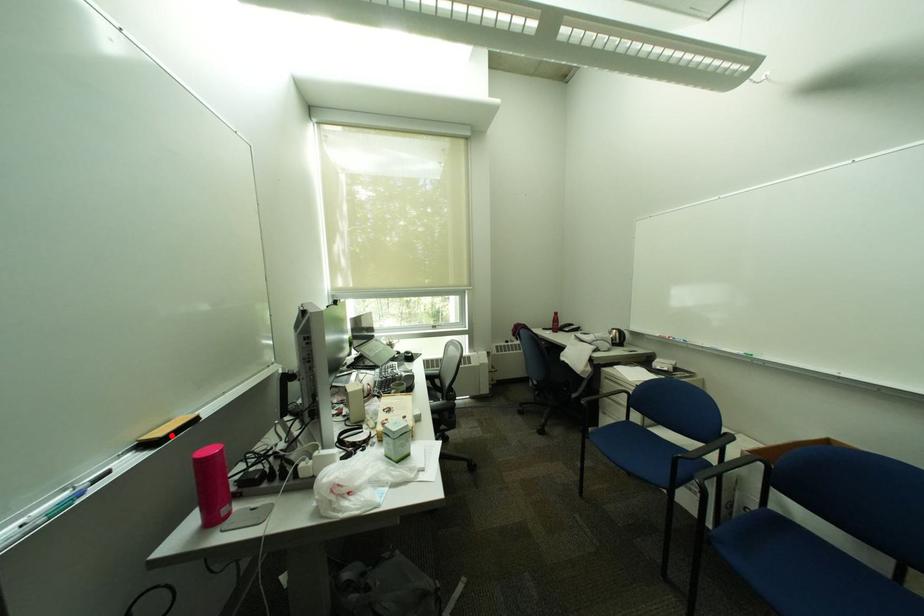
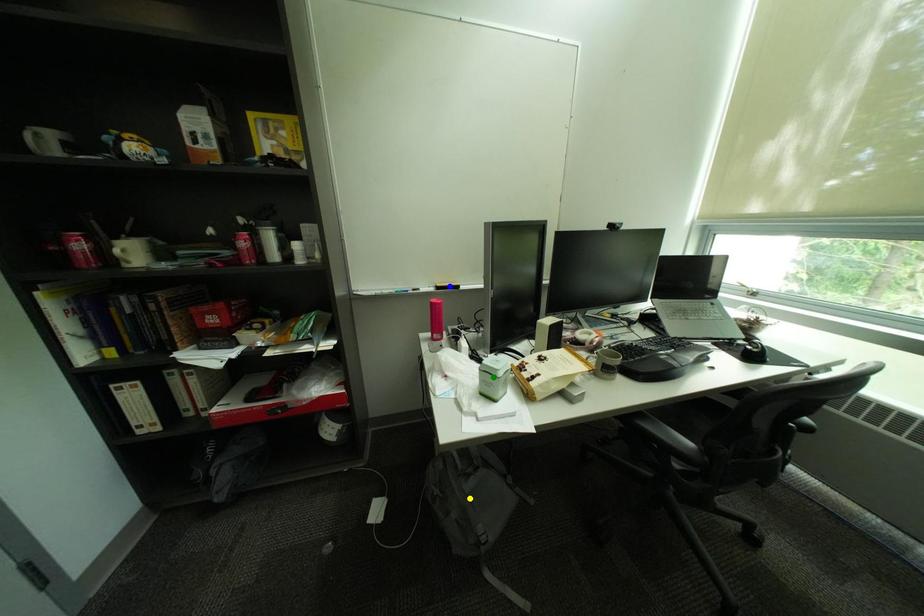
Question: I am providing you with two images of the same scene from different viewpoints. A red point is marked on the first image. You are given multiple points on the second image. In image 2, which mark is for the same physical point as the one in image 1?

Choices:
 (A) green point
 (B) blue point
 (C) yellow point

Answer: (B)